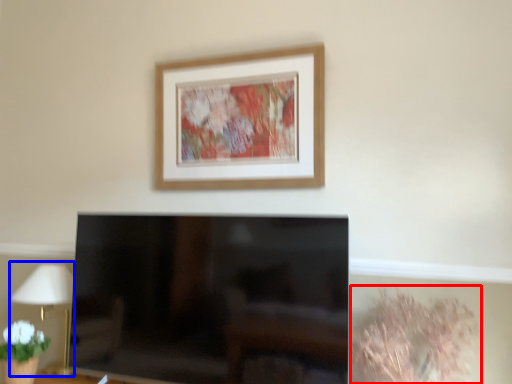
Question: Which object is closer to the camera taking this photo, plant (highlighted by a red box) or table lamp (highlighted by a blue box)?

Choices:
 (A) plant
 (B) table lamp

Answer: (A)